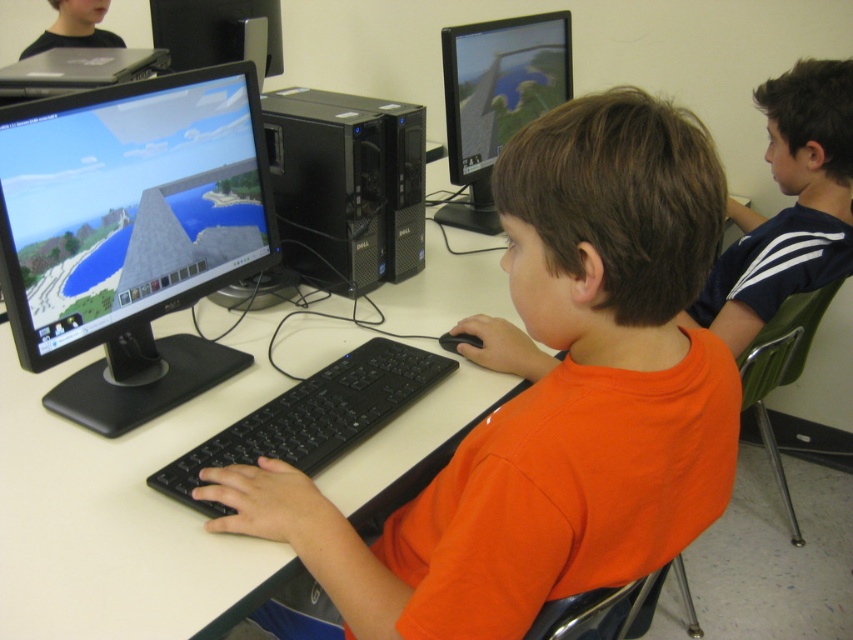
Question: Which of the following is the farthest from the observer?

Choices:
 (A) (805, 276)
 (B) (33, 273)
 (C) (489, 193)

Answer: (C)

Question: Which object is closer to the camera taking this photo?

Choices:
 (A) orange matte shirt at center
 (B) black plastic keyboard at center

Answer: (A)

Question: Does white matte table at center appear over black plastic keyboard at center?

Choices:
 (A) yes
 (B) no

Answer: (A)

Question: Which of the following is the farthest from the observer?

Choices:
 (A) (339, 380)
 (B) (688, 211)

Answer: (A)

Question: Can you confirm if dark blue jersey at upper right is thinner than matte black monitor at center?

Choices:
 (A) yes
 (B) no

Answer: (B)

Question: Is black plastic monitor at center thinner than black plastic computer tower at center?

Choices:
 (A) yes
 (B) no

Answer: (A)